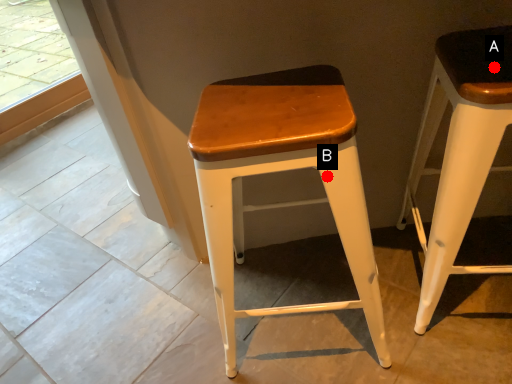
Question: Two points are circled on the image, labeled by A and B beside each circle. Which point appears closest to the camera in this image?

Choices:
 (A) A is closer
 (B) B is closer

Answer: (B)